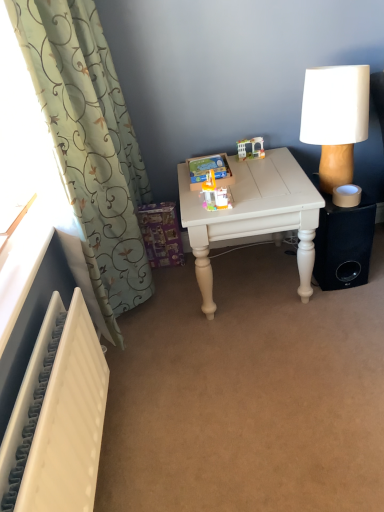
You are a GUI agent. You are given a task and a screenshot of the screen. Output one action in this format:
    pyautogui.click(x=<x>, y=<y>)
    Task: Click on the vacant area that is in front of black matte speaker at lower right
    The image size is (384, 512).
    Given the screenshot: What is the action you would take?
    pyautogui.click(x=342, y=306)